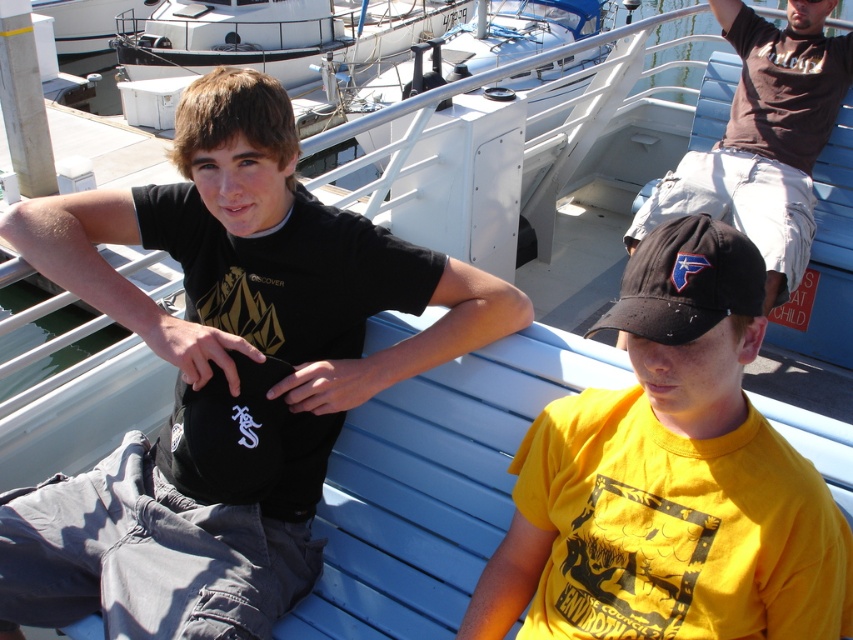
Question: Which of the following is the farthest from the observer?

Choices:
 (A) matte brown t-shirt at upper right
 (B) yellow matte t-shirt at center

Answer: (A)

Question: From the image, what is the correct spatial relationship of black matte t-shirt at upper left in relation to yellow matte t-shirt at center?

Choices:
 (A) left
 (B) right

Answer: (A)

Question: Does white glossy boat at upper center appear on the right side of black fabric baseball cap at lower center?

Choices:
 (A) yes
 (B) no

Answer: (B)

Question: Is yellow matte t-shirt at center smaller than matte brown t-shirt at upper right?

Choices:
 (A) no
 (B) yes

Answer: (B)

Question: Which point is farther from the camera taking this photo?

Choices:
 (A) (321, 337)
 (B) (749, 228)
 (C) (689, 432)
 (D) (639, 253)

Answer: (B)

Question: Which point is closer to the camera?

Choices:
 (A) black fabric baseball cap at lower center
 (B) matte brown t-shirt at upper right
 (C) white glossy boat at upper center
 (D) black matte t-shirt at upper left

Answer: (A)